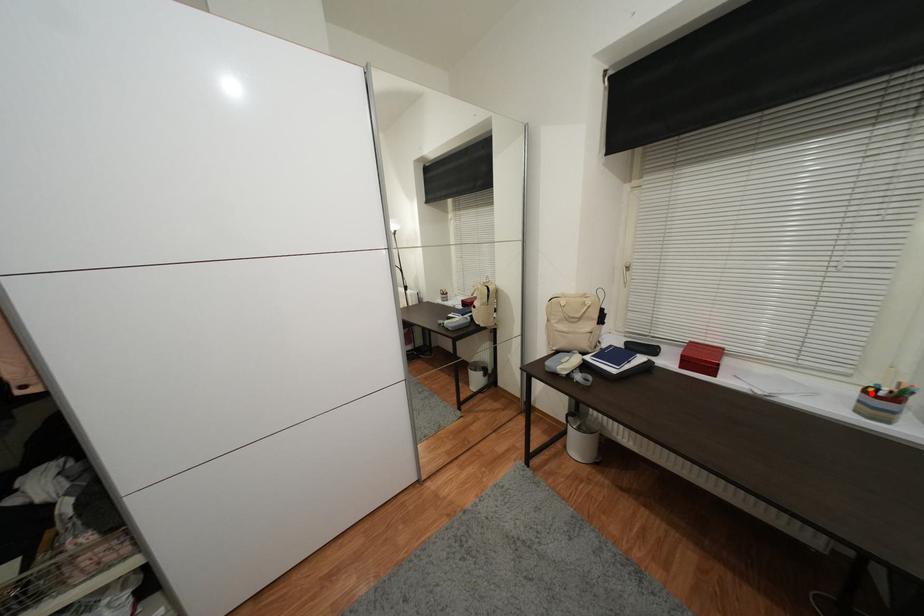
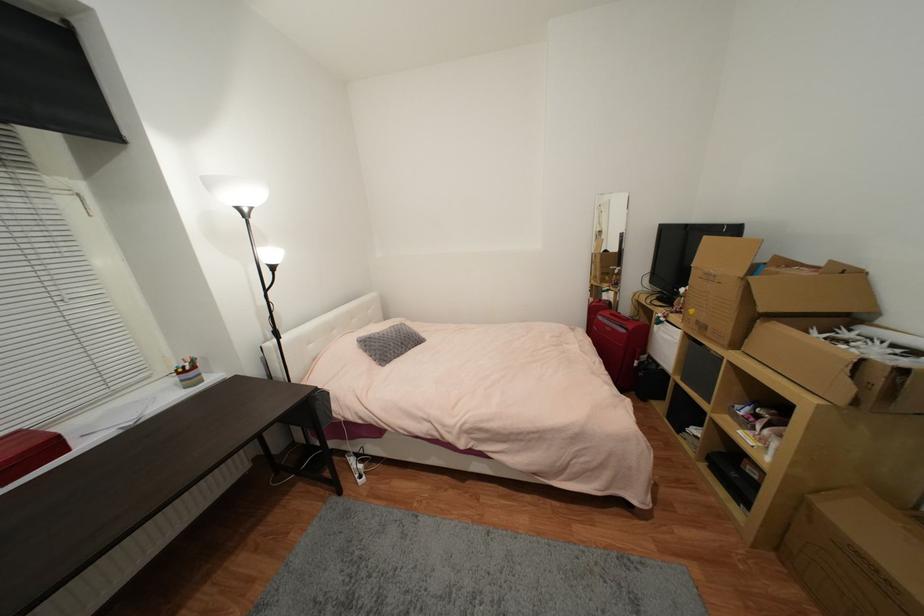
Find the pixel in the second image that matches the highlighted location in the first image.

(185, 374)